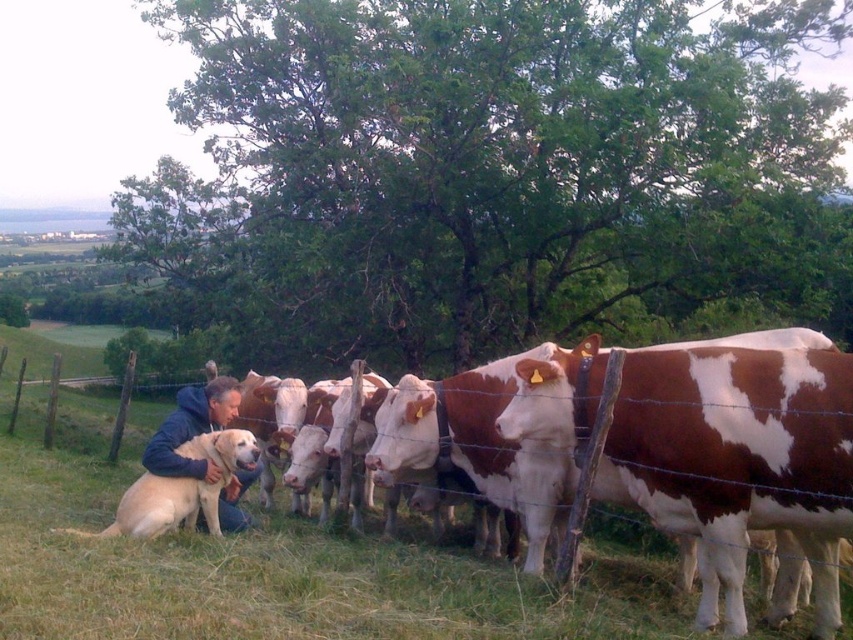
Does golden fur dog at lower left have a lesser height compared to golden fur dog at center?

Correct, golden fur dog at lower left is not as tall as golden fur dog at center.

Where is `golden fur dog at lower left`? The image size is (853, 640). golden fur dog at lower left is located at coordinates (180, 490).

Does point (239, 458) come in front of point (167, 426)?

Yes, it is.

Where is `golden fur dog at lower left`? golden fur dog at lower left is located at coordinates (180, 490).